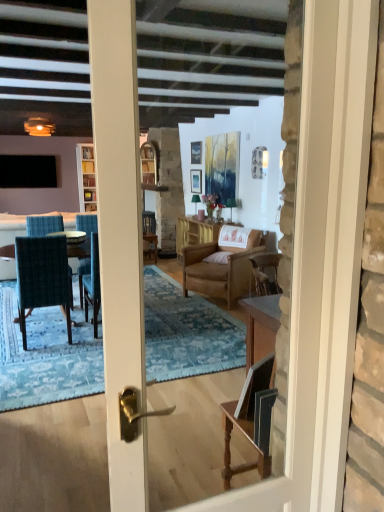
The height and width of the screenshot is (512, 384). What do you see at coordinates (196, 181) in the screenshot? I see `matte wooden picture frame at center, the first picture frame from the bottom` at bounding box center [196, 181].

Where is `clear glass cabinet at center`? This screenshot has height=512, width=384. clear glass cabinet at center is located at coordinates (149, 163).

I want to click on brown woven table at center, so click(194, 233).

Where is `matte glass candle at upper left`? This screenshot has height=512, width=384. matte glass candle at upper left is located at coordinates (39, 127).

This screenshot has height=512, width=384. What do you see at coordinates (28, 170) in the screenshot?
I see `black matte television at left` at bounding box center [28, 170].

This screenshot has width=384, height=512. Find the location of `teal fabric chair at left, the 2th chair positioned from the right`. teal fabric chair at left, the 2th chair positioned from the right is located at coordinates (42, 277).

From a real-world perspective, which object rests below the other?

In real-world perspective, matte wooden picture frame at center, the first picture frame from the bottom, is lower.

In terms of size, does matte wooden picture frame at center, the first picture frame from the bottom, appear bigger or smaller than clear glass cabinet at center?

Clearly, matte wooden picture frame at center, the first picture frame from the bottom, is smaller in size than clear glass cabinet at center.

Is point (191, 181) farther from viewer compared to point (151, 155)?

Yes.

Is matte wooden picture frame at center, which is counted as the 2th picture frame, starting from the top, to the right of clear glass cabinet at center from the viewer's perspective?

Correct, you'll find matte wooden picture frame at center, which is counted as the 2th picture frame, starting from the top, to the right of clear glass cabinet at center.

Does matte wooden picture frame at center, the first picture frame from the bottom, have a lesser height compared to teal fabric chair at left, placed as the first chair when sorted from front to back?

Correct, matte wooden picture frame at center, the first picture frame from the bottom, is not as tall as teal fabric chair at left, placed as the first chair when sorted from front to back.

In the scene shown: How far apart are matte wooden picture frame at center, the first picture frame from the bottom, and teal fabric chair at left, placed as the first chair when sorted from front to back?

A distance of 12.12 feet exists between matte wooden picture frame at center, the first picture frame from the bottom, and teal fabric chair at left, placed as the first chair when sorted from front to back.

There is a matte wooden picture frame at center, the first picture frame from the bottom. Identify the location of the 2nd chair below it (from the image's perspective). This screenshot has height=512, width=384. (42, 277).

Considering the relative sizes of matte wooden picture frame at center, the first picture frame from the bottom, and teal fabric chair at left, the 2th chair positioned from the back, in the image provided, is matte wooden picture frame at center, the first picture frame from the bottom, thinner than teal fabric chair at left, the 2th chair positioned from the back,?

Correct, the width of matte wooden picture frame at center, the first picture frame from the bottom, is less than that of teal fabric chair at left, the 2th chair positioned from the back.

Between black matte television at left and teal fabric chair at left, placed as the first chair when sorted from left to right, which one is positioned in front?

teal fabric chair at left, placed as the first chair when sorted from left to right, is closer to the camera.

From the picture: Is black matte television at left wider or thinner than teal fabric chair at left, placed as the first chair when sorted from front to back?

black matte television at left is thinner than teal fabric chair at left, placed as the first chair when sorted from front to back.

Does black matte television at left contain teal fabric chair at left, placed as the first chair when sorted from front to back?

That's incorrect, teal fabric chair at left, placed as the first chair when sorted from front to back, is not inside black matte television at left.

Does point (50, 178) appear closer or farther from the camera than point (157, 170)?

Point (50, 178) is farther from the camera than point (157, 170).

Considering the relative positions of black matte television at left and clear glass cabinet at center in the image provided, is black matte television at left in front of clear glass cabinet at center?

No, it is not.

Is clear glass cabinet at center at the back of black matte television at left?

No, black matte television at left is not facing away from clear glass cabinet at center.

Between black matte television at left and clear glass cabinet at center, which one has less height?

black matte television at left is shorter.

Based on the photo, is matte glass candle at upper left in contact with matte wooden picture frame at center, which is counted as the 2th picture frame, starting from the top?

No, matte glass candle at upper left is not beside matte wooden picture frame at center, which is counted as the 2th picture frame, starting from the top.

Looking at the image, does matte glass candle at upper left seem bigger or smaller compared to matte wooden picture frame at center, which is counted as the 2th picture frame, starting from the top?

matte glass candle at upper left is bigger than matte wooden picture frame at center, which is counted as the 2th picture frame, starting from the top.

Which is in front, point (46, 121) or point (198, 174)?

The point (46, 121) is in front.

Who is more distant, matte glass candle at upper left or black matte television at left?

black matte television at left is further from the camera.

Would you say matte glass candle at upper left is to the left or to the right of black matte television at left in the picture?

Clearly, matte glass candle at upper left is on the right of black matte television at left in the image.

Where is `lamp located on the right of black matte television at left`? This screenshot has height=512, width=384. lamp located on the right of black matte television at left is located at coordinates (39, 127).

From the image's perspective, who appears lower, matte glass candle at upper left or black matte television at left?

matte glass candle at upper left, from the image's perspective.

From the image's perspective, which is above, teal fabric chair at left, placed as the first chair when sorted from front to back, or matte glass candle at upper left?

matte glass candle at upper left appears higher in the image.

Considering the sizes of objects teal fabric chair at left, the 2th chair positioned from the back, and matte glass candle at upper left in the image provided, who is wider, teal fabric chair at left, the 2th chair positioned from the back, or matte glass candle at upper left?

teal fabric chair at left, the 2th chair positioned from the back, is wider.

Considering the positions of objects teal fabric chair at left, placed as the first chair when sorted from left to right, and matte glass candle at upper left in the image provided, who is more to the left, teal fabric chair at left, placed as the first chair when sorted from left to right, or matte glass candle at upper left?

matte glass candle at upper left.

What's the angular difference between teal fabric chair at left, placed as the first chair when sorted from front to back, and matte glass candle at upper left's facing directions?

4.92 degrees.

Locate an element on the screen. This screenshot has height=512, width=384. the 2nd picture frame below the clear glass cabinet at center (from the image's perspective) is located at coordinates (196, 181).

Where is `the 2nd picture frame behind when counting from the teal fabric chair at left, the 2th chair positioned from the right`? the 2nd picture frame behind when counting from the teal fabric chair at left, the 2th chair positioned from the right is located at coordinates (196, 181).

Which object lies nearer to the anchor point brown leather armchair at center, marked as the second chair in a left-to-right arrangement, brown woven table at center or teal fabric chair at left, the 2th chair positioned from the back?

The object closer to brown leather armchair at center, marked as the second chair in a left-to-right arrangement, is brown woven table at center.

Looking at the image, which one is located further to matte wooden picture frame at center, which is counted as the 2th picture frame, starting from the top, black matte television at left or metallic silver picture frame at upper center, the 1th picture frame in the top-to-bottom sequence?

The object further to matte wooden picture frame at center, which is counted as the 2th picture frame, starting from the top, is black matte television at left.

Looking at the image, which one is located closer to clear glass cabinet at center, matte glass candle at upper left or black matte television at left?

Among the two, black matte television at left is located nearer to clear glass cabinet at center.

From the image, which object appears to be nearer to brown leather armchair at center, acting as the second chair starting from the front, matte wooden picture frame at center, which is counted as the 2th picture frame, starting from the top, or teal fabric chair at left, the 2th chair positioned from the back?

teal fabric chair at left, the 2th chair positioned from the back.

Consider the image. Estimate the real-world distances between objects in this image. Which object is closer to teal fabric chair at left, the 2th chair positioned from the back, black matte television at left or brown leather armchair at center, acting as the second chair starting from the front?

The object closer to teal fabric chair at left, the 2th chair positioned from the back, is brown leather armchair at center, acting as the second chair starting from the front.

Based on their spatial positions, is metallic silver picture frame at upper center, the 1th picture frame in the top-to-bottom sequence, or black matte television at left further from brown woven table at center?

black matte television at left is positioned further to the anchor brown woven table at center.

Considering their positions, is teal fabric chair at left, placed as the first chair when sorted from left to right, positioned further to metallic silver picture frame at upper center, the 2th picture frame when ordered from bottom to top, than brown leather armchair at center, the first chair in the right-to-left sequence?

The object further to metallic silver picture frame at upper center, the 2th picture frame when ordered from bottom to top, is teal fabric chair at left, placed as the first chair when sorted from left to right.

When comparing their distances from clear glass cabinet at center, does matte wooden picture frame at center, the first picture frame from the bottom, or brown woven table at center seem further?

matte wooden picture frame at center, the first picture frame from the bottom, is further to clear glass cabinet at center.

Locate an element on the screen. The height and width of the screenshot is (512, 384). table between brown leather armchair at center, marked as the second chair in a left-to-right arrangement, and matte wooden picture frame at center, which is counted as the 2th picture frame, starting from the top, along the z-axis is located at coordinates (194, 233).

Where is `lamp between teal fabric chair at left, placed as the first chair when sorted from front to back, and brown woven table at center, along the z-axis`? The width and height of the screenshot is (384, 512). lamp between teal fabric chair at left, placed as the first chair when sorted from front to back, and brown woven table at center, along the z-axis is located at coordinates (39, 127).

The image size is (384, 512). I want to click on chair between teal fabric chair at left, the 2th chair positioned from the right, and black matte television at left, along the z-axis, so click(x=221, y=269).

The image size is (384, 512). What are the coordinates of `picture frame between black matte television at left and matte wooden picture frame at center, which is counted as the 2th picture frame, starting from the top, from left to right` in the screenshot? It's located at (196, 152).